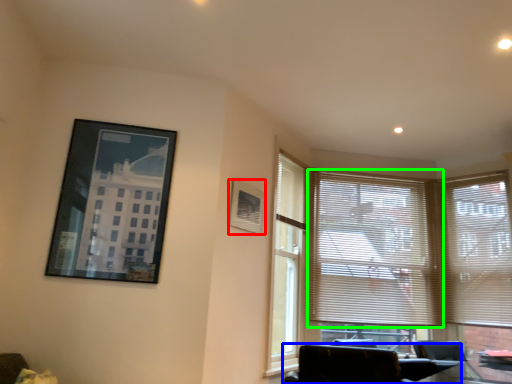
Question: Which is nearer to the picture frame (highlighted by a red box)? chair (highlighted by a blue box) or window blind (highlighted by a green box).

Choices:
 (A) chair
 (B) window blind

Answer: (A)